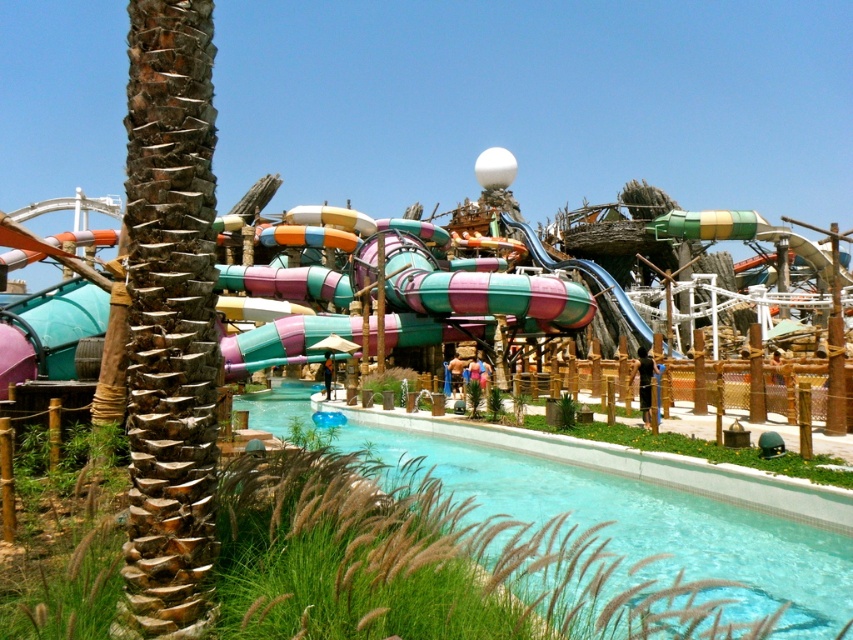
Question: Among these points, which one is farthest from the camera?

Choices:
 (A) (198, 113)
 (B) (415, 456)

Answer: (B)

Question: Considering the relative positions of brown/scaly trunk at left and clear glass pool at center in the image provided, where is brown/scaly trunk at left located with respect to clear glass pool at center?

Choices:
 (A) above
 (B) below

Answer: (A)

Question: Is brown/scaly trunk at left further to camera compared to clear glass pool at center?

Choices:
 (A) no
 (B) yes

Answer: (A)

Question: Which object is closer to the camera taking this photo?

Choices:
 (A) brown/scaly trunk at left
 (B) clear glass pool at center

Answer: (A)

Question: Does brown/scaly trunk at left appear under clear glass pool at center?

Choices:
 (A) yes
 (B) no

Answer: (B)